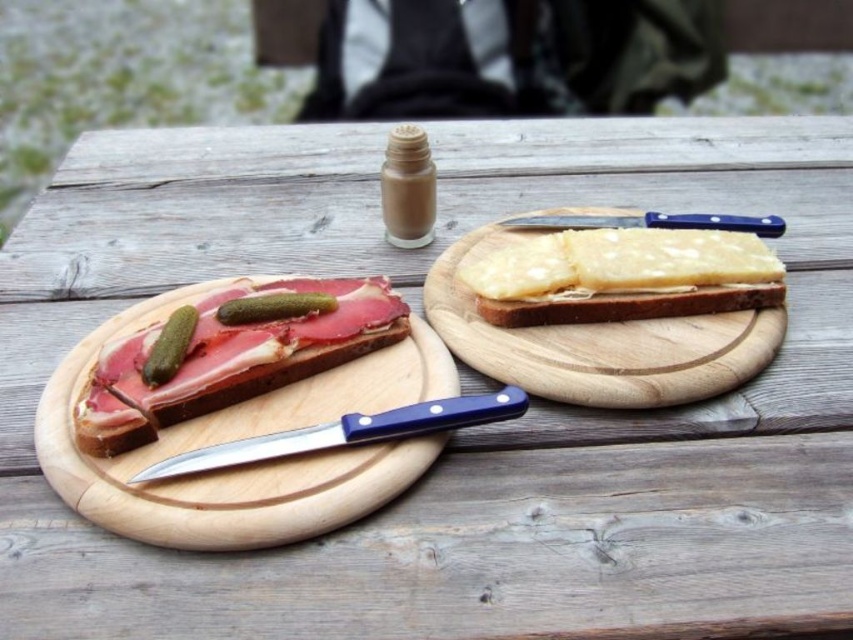
Who is more forward, (274, 440) or (750, 216)?

Point (274, 440) is more forward.

Is blue polished knife at center shorter than blue plastic knife at upper right?

Incorrect, blue polished knife at center's height does not fall short of blue plastic knife at upper right's.

This screenshot has height=640, width=853. What do you see at coordinates (346, 433) in the screenshot?
I see `blue polished knife at center` at bounding box center [346, 433].

Where is `blue polished knife at center`? blue polished knife at center is located at coordinates (346, 433).

Looking at this image, how much distance is there between wooden cutting board at center and shiny white cheese at center?

A distance of 0.74 inches exists between wooden cutting board at center and shiny white cheese at center.

What are the coordinates of `wooden cutting board at center` in the screenshot? It's located at [x=610, y=310].

Between point (540, 364) and point (612, 314), which one is positioned behind?

Positioned behind is point (612, 314).

This screenshot has height=640, width=853. What are the coordinates of `wooden cutting board at center` in the screenshot? It's located at (610, 310).

This screenshot has height=640, width=853. What do you see at coordinates (624, 276) in the screenshot?
I see `shiny white cheese at center` at bounding box center [624, 276].

Which of these two, shiny white cheese at center or blue plastic knife at upper right, stands shorter?

blue plastic knife at upper right is shorter.

Which is in front, point (508, 289) or point (755, 218)?

Positioned in front is point (508, 289).

This screenshot has height=640, width=853. What are the coordinates of `shiny white cheese at center` in the screenshot? It's located at (624, 276).